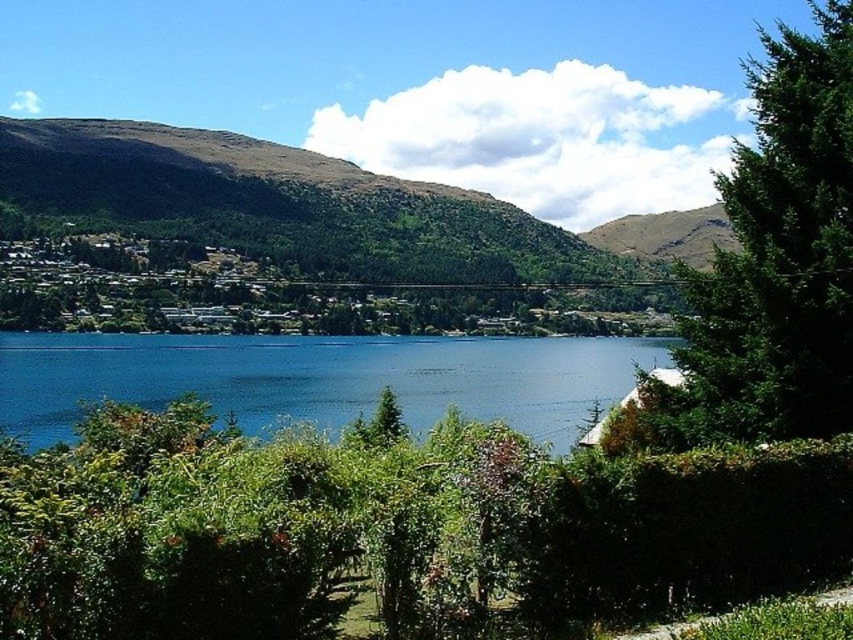
Is green leafy tree at right shorter than blue water at center?

No.

Can you confirm if green leafy tree at right is thinner than blue water at center?

Yes.

Is point (827, 113) closer to viewer compared to point (44, 390)?

Yes, point (827, 113) is closer to viewer.

Find the location of a particular element. green leafy tree at right is located at coordinates (776, 260).